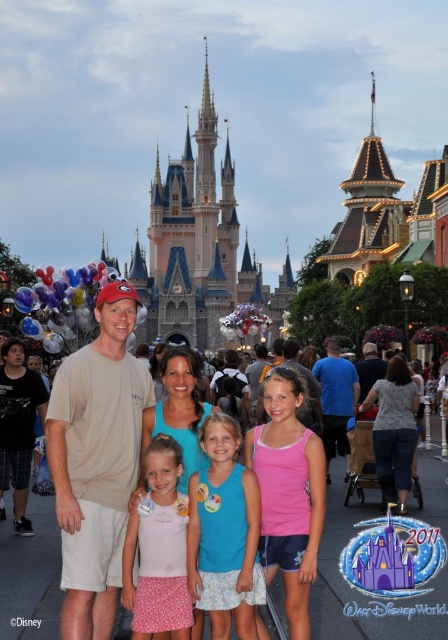
Question: Which of the following is the closest to the observer?

Choices:
 (A) (358, 634)
 (B) (126, 528)
 (C) (231, 513)

Answer: (C)

Question: Which object is the farthest from the matte khaki shirt at center?

Choices:
 (A) pink fabric dress at center
 (B) blue cotton tank top at center

Answer: (A)

Question: Is matte khaki shirt at center positioned at the back of pink fabric dress at center?

Choices:
 (A) yes
 (B) no

Answer: (A)

Question: Can you confirm if blue cotton tank top at center is bigger than pink fabric dress at center?

Choices:
 (A) yes
 (B) no

Answer: (A)

Question: Can you confirm if matte khaki shirt at center is wider than blue cotton tank top at center?

Choices:
 (A) yes
 (B) no

Answer: (A)

Question: Which object is farther from the camera taking this photo?

Choices:
 (A) blue cotton tank top at center
 (B) matte khaki shirt at center

Answer: (B)